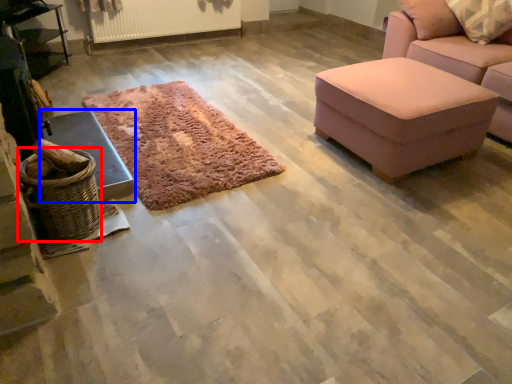
Question: Which object is closer to the camera taking this photo, basket (highlighted by a red box) or furniture (highlighted by a blue box)?

Choices:
 (A) basket
 (B) furniture

Answer: (A)